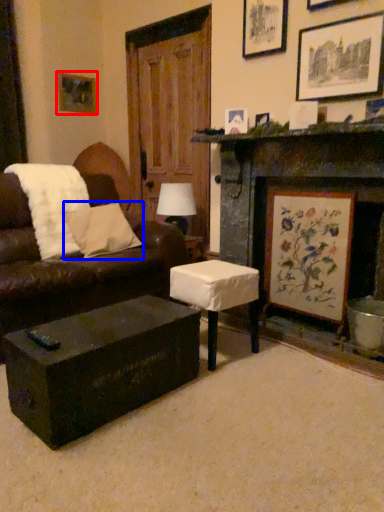
Question: Among these objects, which one is nearest to the camera, picture frame (highlighted by a red box) or pillow (highlighted by a blue box)?

Choices:
 (A) picture frame
 (B) pillow

Answer: (B)